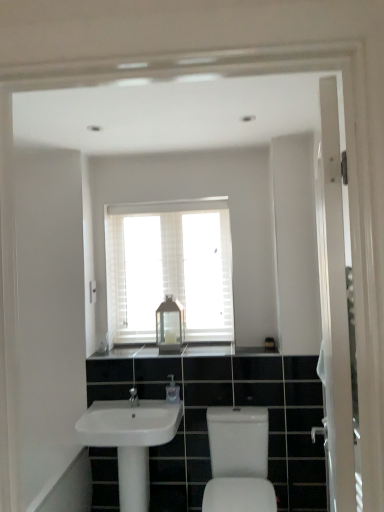
Image resolution: width=384 pixels, height=512 pixels. I want to click on free space that is in between clear plastic soap dispenser at center and matte silver tap at center, so click(147, 402).